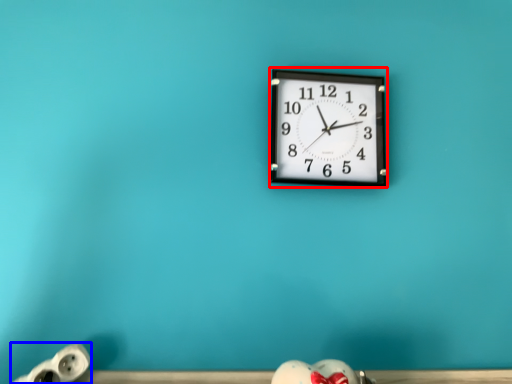
Question: Among these objects, which one is nearest to the camera, wall clock (highlighted by a red box) or toy (highlighted by a blue box)?

Choices:
 (A) wall clock
 (B) toy

Answer: (B)